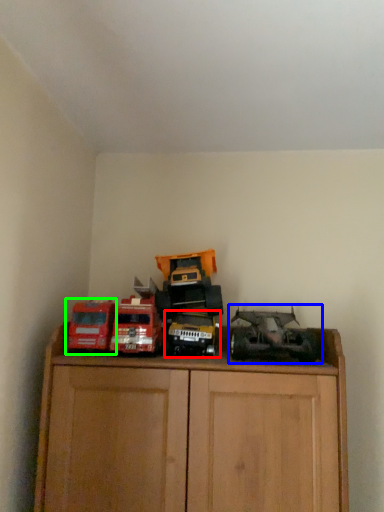
Question: Which object is positioned farthest from toy (highlighted by a red box)? Select from toy (highlighted by a blue box) and toy (highlighted by a green box).

Choices:
 (A) toy
 (B) toy

Answer: (B)